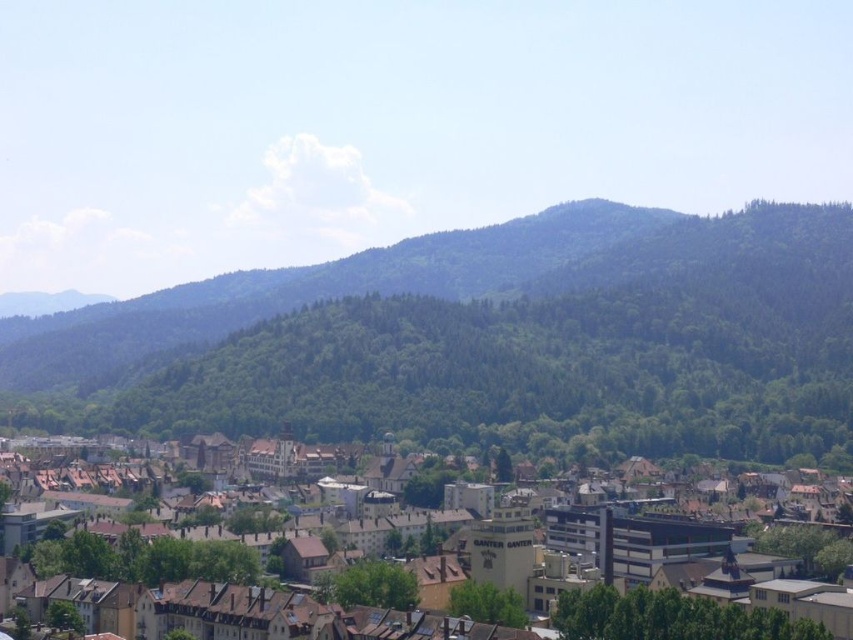
You are standing at the point marked as point (x=489, y=340) in the image. What is the immediate terrain beneath your feet?

The immediate terrain beneath your feet at point (x=489, y=340) is green forested mountain, as indicated by the Objects Description.

You are standing in the town looking towards the mountains. You notice two points marked in the image. Which point, point at (x=345, y=381) or point at (x=625, y=634), is closer to you?

Point at (x=345, y=381) is closer to you because it is further to the viewer than point at (x=625, y=634).